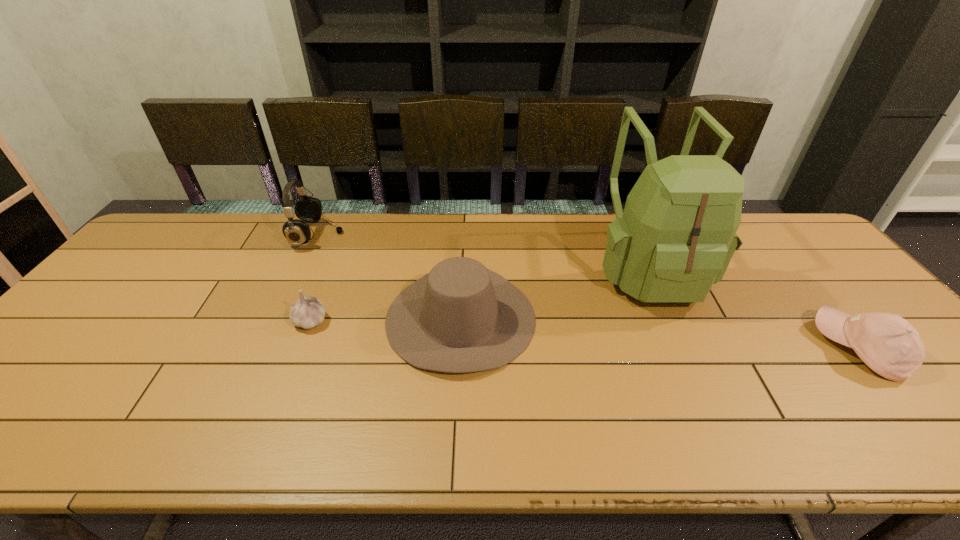
Identify the location of object that is the second closest one to the headset. This screenshot has height=540, width=960. (308, 312).

Where is `object that is the closest to the second object from right to left`? The width and height of the screenshot is (960, 540). object that is the closest to the second object from right to left is located at coordinates (888, 344).

At what (x,y) coordinates should I click in order to perform the action: click on vacant region that satisfies the following two spatial constraints: 1. with the microphone on the side of the second tallest object; 2. on the right side of the garlic. Please return your answer as a coordinate pair (x, y). The image size is (960, 540). Looking at the image, I should click on (278, 321).

Where is `free space that satisfies the following two spatial constraints: 1. on the back side of the garlic; 2. on the left side of the cowboy hat`? The height and width of the screenshot is (540, 960). free space that satisfies the following two spatial constraints: 1. on the back side of the garlic; 2. on the left side of the cowboy hat is located at coordinates (311, 318).

What are the coordinates of `vacant space that satisfies the following two spatial constraints: 1. with the microphone on the side of the second tallest object; 2. on the left side of the cowboy hat` in the screenshot? It's located at (279, 318).

Where is `free space that satisfies the following two spatial constraints: 1. with the microphone on the side of the second tallest object; 2. on the right side of the garlic`? This screenshot has width=960, height=540. free space that satisfies the following two spatial constraints: 1. with the microphone on the side of the second tallest object; 2. on the right side of the garlic is located at coordinates (278, 321).

I want to click on free space that satisfies the following two spatial constraints: 1. with the microphone on the side of the fourth shortest object; 2. on the right side of the garlic, so click(278, 321).